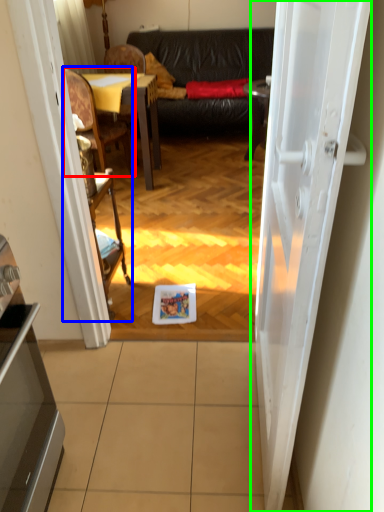
Question: Based on their relative distances, which object is farther from chair (highlighted by a red box)? Choose from armchair (highlighted by a blue box) and door (highlighted by a green box).

Choices:
 (A) armchair
 (B) door

Answer: (B)